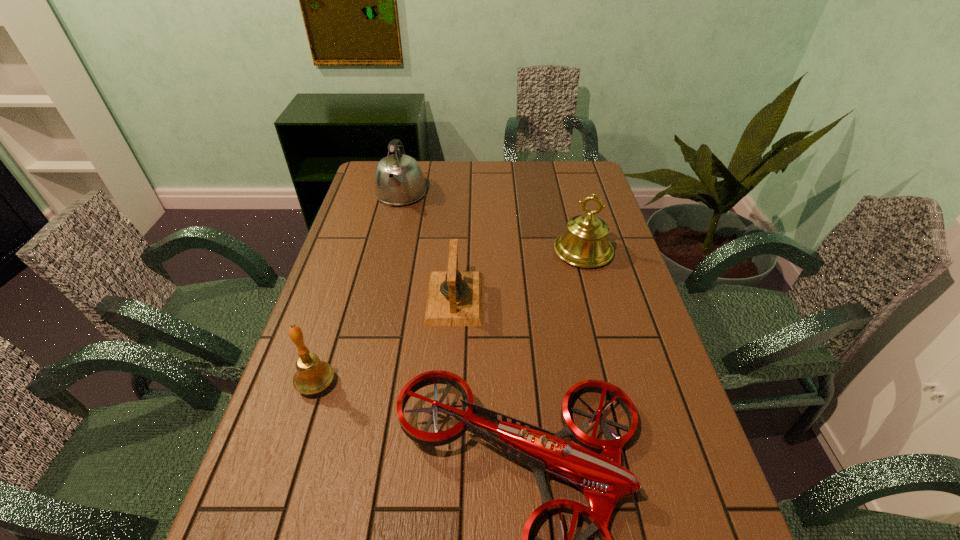
Identify the location of blank region between the farthest object and the fourth nearest object. The height and width of the screenshot is (540, 960). (492, 222).

At what (x,y) coordinates should I click in order to perform the action: click on empty location between the farthest object and the rightmost bell. Please return your answer as a coordinate pair (x, y). This screenshot has width=960, height=540. Looking at the image, I should click on (492, 222).

Where is `vacant space that is in between the kettle and the fourth nearest object`? The width and height of the screenshot is (960, 540). vacant space that is in between the kettle and the fourth nearest object is located at coordinates (492, 222).

The width and height of the screenshot is (960, 540). Find the location of `vacant area that lies between the leftmost bell and the kettle`. vacant area that lies between the leftmost bell and the kettle is located at coordinates (358, 289).

Select which object is the second closest to the farthest bell. Please provide its 2D coordinates. Your answer should be formatted as a tuple, i.e. [(x, y)], where the tuple contains the x and y coordinates of a point satisfying the conditions above.

[(601, 478)]

Find the location of a particular element. The height and width of the screenshot is (540, 960). object identified as the second closest to the farthest object is located at coordinates (584, 244).

Where is `bell that is the nearest to the nearest bell`? bell that is the nearest to the nearest bell is located at coordinates (454, 298).

This screenshot has width=960, height=540. I want to click on bell that is the closest to the second nearest bell, so click(584, 244).

The height and width of the screenshot is (540, 960). In order to click on blank space that satisfies the following two spatial constraints: 1. on the spout of the farthest bell; 2. on the left side of the kettle in this screenshot , I will do `click(387, 251)`.

Where is `free space that satisfies the following two spatial constraints: 1. on the spout of the second farthest object; 2. on the left side of the farthest object`? The image size is (960, 540). free space that satisfies the following two spatial constraints: 1. on the spout of the second farthest object; 2. on the left side of the farthest object is located at coordinates (387, 251).